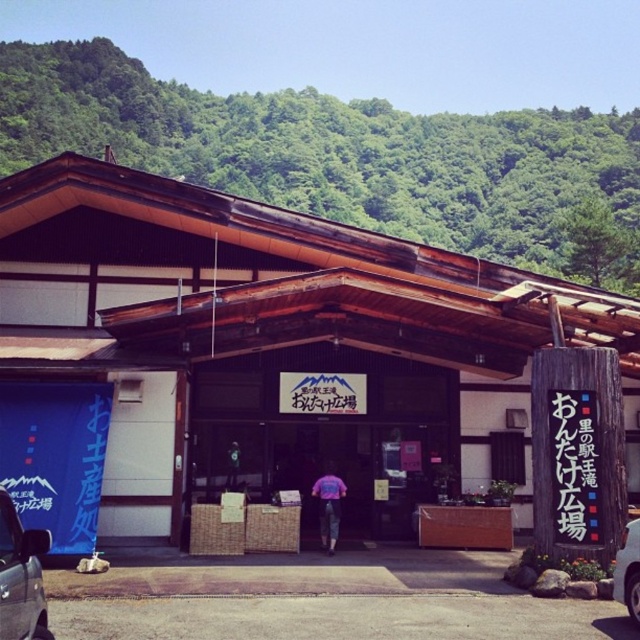
Question: Which of the following is the closest to the observer?

Choices:
 (A) (8, 573)
 (B) (632, 525)
 (C) (97, 52)

Answer: (A)

Question: Can you confirm if green leafy hillside at upper center is positioned to the left of metallic gray car at lower left?

Choices:
 (A) yes
 (B) no

Answer: (B)

Question: Can you confirm if green leafy hillside at upper center is positioned to the right of white glossy car at lower right?

Choices:
 (A) no
 (B) yes

Answer: (A)

Question: Observing the image, what is the correct spatial positioning of green leafy hillside at upper center in reference to white glossy car at lower right?

Choices:
 (A) left
 (B) right

Answer: (A)

Question: Which object is positioned farthest from the pink fabric jacket at center?

Choices:
 (A) white glossy car at lower right
 (B) green leafy hillside at upper center

Answer: (B)

Question: Which of the following is the closest to the observer?

Choices:
 (A) white wood store at center
 (B) pink fabric jacket at center
 (C) green leafy hillside at upper center
 (D) white glossy car at lower right

Answer: (D)